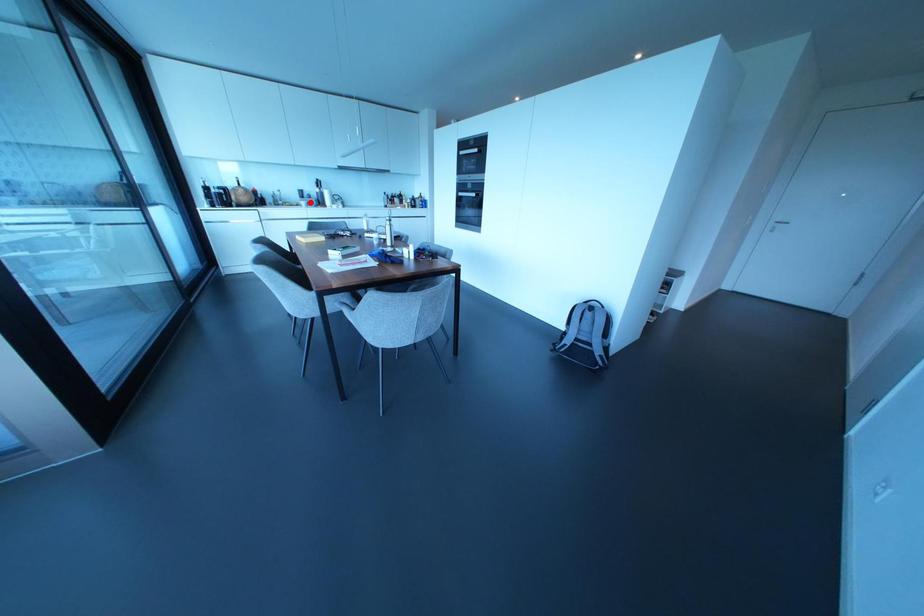
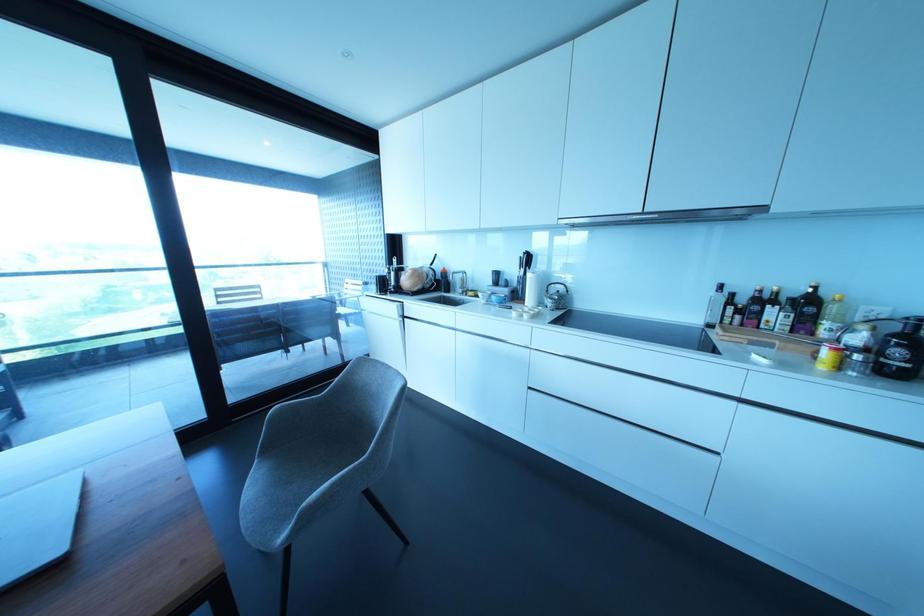
Question: I am providing you with two images of the same scene from different viewpoints. Image1 has a red point marked. In image2, the corresponding 3D location appears at what relative position? Reply with the corresponding letter.

Choices:
 (A) Closer
 (B) Farther

Answer: (B)